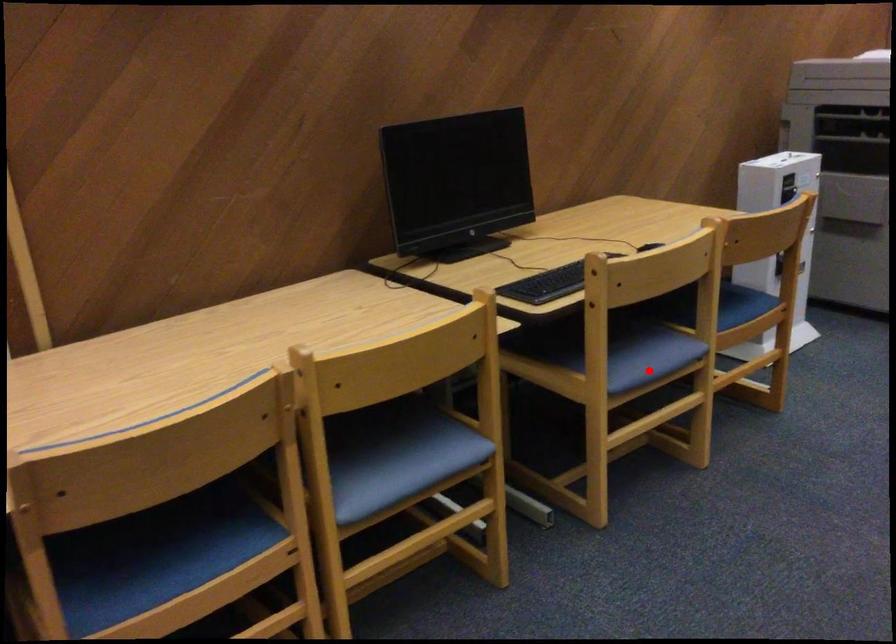
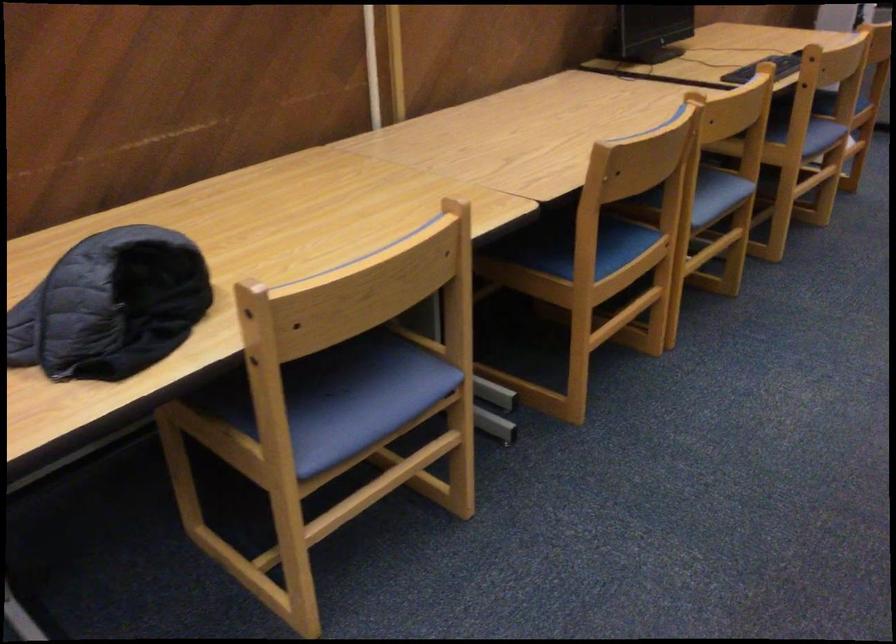
Question: I am providing you with two images of the same scene from different viewpoints. Given a red point in image1, look at the same physical point in image2. Is it:

Choices:
 (A) Closer to the viewpoint
 (B) Farther from the viewpoint

Answer: (B)